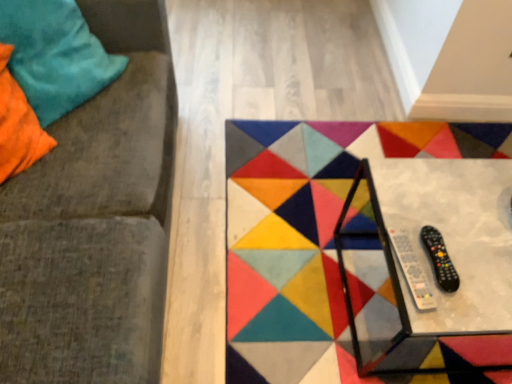
Identify the location of velvet cushion at left. This screenshot has height=384, width=512. (95, 221).

This screenshot has width=512, height=384. I want to click on velvety teal pillow at upper left, so click(x=55, y=55).

What do you see at coordinates (424, 257) in the screenshot? I see `metallic glass table at center` at bounding box center [424, 257].

The width and height of the screenshot is (512, 384). I want to click on velvet cushion at left, so click(x=95, y=221).

Is metallic glass table at center thinner than velvet cushion at left?

Yes.

Considering the relative sizes of metallic glass table at center and velvet cushion at left in the image provided, is metallic glass table at center bigger than velvet cushion at left?

No.

Does point (475, 214) come behind point (97, 272)?

That is True.

From the image's perspective, is metallic glass table at center under velvet cushion at left?

Yes, from the image's perspective, metallic glass table at center is below velvet cushion at left.

From the picture: Between black plastic remote at lower right and velvety teal pillow at upper left, which one has more height?

With more height is velvety teal pillow at upper left.

Do you think black plastic remote at lower right is within velvety teal pillow at upper left, or outside of it?

black plastic remote at lower right is located beyond the bounds of velvety teal pillow at upper left.

How many degrees apart are the facing directions of black plastic remote at lower right and velvety teal pillow at upper left?

black plastic remote at lower right and velvety teal pillow at upper left are facing 27.8 degrees away from each other.

Locate an element on the screen. remote below the velvety teal pillow at upper left (from a real-world perspective) is located at coordinates [412, 270].

Does metallic glass table at center have a lesser height compared to black plastic remote at lower right?

No.

From the image's perspective, is metallic glass table at center on black plastic remote at lower right?

No, from the image's perspective, metallic glass table at center is not over black plastic remote at lower right.

Considering the relative positions of metallic glass table at center and black plastic remote at lower right in the image provided, is metallic glass table at center behind black plastic remote at lower right?

No, it is in front of black plastic remote at lower right.

In the image, is velvet cushion at left positioned in front of or behind velvety teal pillow at upper left?

velvet cushion at left is in front of velvety teal pillow at upper left.

From the image's perspective, which is above, velvet cushion at left or velvety teal pillow at upper left?

From the image's view, velvety teal pillow at upper left is above.

Does point (74, 111) lie in front of point (47, 31)?

No.

Considering the relative sizes of velvet cushion at left and velvety teal pillow at upper left in the image provided, is velvet cushion at left thinner than velvety teal pillow at upper left?

Incorrect, the width of velvet cushion at left is not less than that of velvety teal pillow at upper left.

Does velvet cushion at left lie in front of black plastic remote control at lower right?

Yes, it is.

From the image's perspective, is velvet cushion at left on top of black plastic remote control at lower right?

Yes, from the image's perspective, velvet cushion at left is on top of black plastic remote control at lower right.

Find the location of a particular element. game controller that appears below the velvet cushion at left (from the image's perspective) is located at coordinates (440, 259).

Considering the sizes of objects velvety teal pillow at upper left and black plastic remote at lower right in the image provided, who is shorter, velvety teal pillow at upper left or black plastic remote at lower right?

With less height is black plastic remote at lower right.

Based on the photo, are velvety teal pillow at upper left and black plastic remote at lower right located far from each other?

Yes, velvety teal pillow at upper left and black plastic remote at lower right are located far from each other.

Is velvety teal pillow at upper left further to the viewer compared to black plastic remote at lower right?

Yes, velvety teal pillow at upper left is behind black plastic remote at lower right.

Is black plastic remote control at lower right smaller than metallic glass table at center?

Yes.

Is metallic glass table at center inside black plastic remote control at lower right?

No, metallic glass table at center is not inside black plastic remote control at lower right.

Could you tell me if black plastic remote control at lower right is facing metallic glass table at center?

Yes, black plastic remote control at lower right is oriented towards metallic glass table at center.

Between black plastic remote control at lower right and metallic glass table at center, which one is positioned behind?

black plastic remote control at lower right is further away from the camera.

Find the location of `furniture above the metallic glass table at center (from a real-world perspective)`. furniture above the metallic glass table at center (from a real-world perspective) is located at coordinates (95, 221).

The height and width of the screenshot is (384, 512). I want to click on remote in front of the velvety teal pillow at upper left, so click(x=412, y=270).

Looking at the image, which one is located further to velvety teal pillow at upper left, metallic glass table at center or black plastic remote control at lower right?

Among the two, black plastic remote control at lower right is located further to velvety teal pillow at upper left.

Looking at the image, which one is located further to black plastic remote at lower right, velvety teal pillow at upper left or velvet cushion at left?

velvety teal pillow at upper left is further to black plastic remote at lower right.

Considering their positions, is velvety teal pillow at upper left positioned further to black plastic remote at lower right than metallic glass table at center?

velvety teal pillow at upper left.

From the image, which object appears to be farther from velvety teal pillow at upper left, black plastic remote at lower right or black plastic remote control at lower right?

black plastic remote control at lower right.

When comparing their distances from velvet cushion at left, does metallic glass table at center or velvety teal pillow at upper left seem further?

The object further to velvet cushion at left is metallic glass table at center.

From the picture: Looking at the image, which one is located further to velvety teal pillow at upper left, black plastic remote control at lower right or metallic glass table at center?

The object further to velvety teal pillow at upper left is black plastic remote control at lower right.

Based on the photo, when comparing their distances from velvet cushion at left, does black plastic remote at lower right or velvety teal pillow at upper left seem closer?

velvety teal pillow at upper left is positioned closer to the anchor velvet cushion at left.

When comparing their distances from black plastic remote at lower right, does velvet cushion at left or black plastic remote control at lower right seem further?

velvet cushion at left.

Locate an element on the screen. The height and width of the screenshot is (384, 512). game controller between black plastic remote at lower right and metallic glass table at center in the horizontal direction is located at coordinates (440, 259).

Locate an element on the screen. The height and width of the screenshot is (384, 512). pillow between velvet cushion at left and black plastic remote control at lower right in the horizontal direction is located at coordinates (55, 55).

The image size is (512, 384). I want to click on game controller located between velvety teal pillow at upper left and metallic glass table at center in the left-right direction, so click(x=440, y=259).

Locate an element on the screen. remote between velvety teal pillow at upper left and black plastic remote control at lower right from left to right is located at coordinates (412, 270).